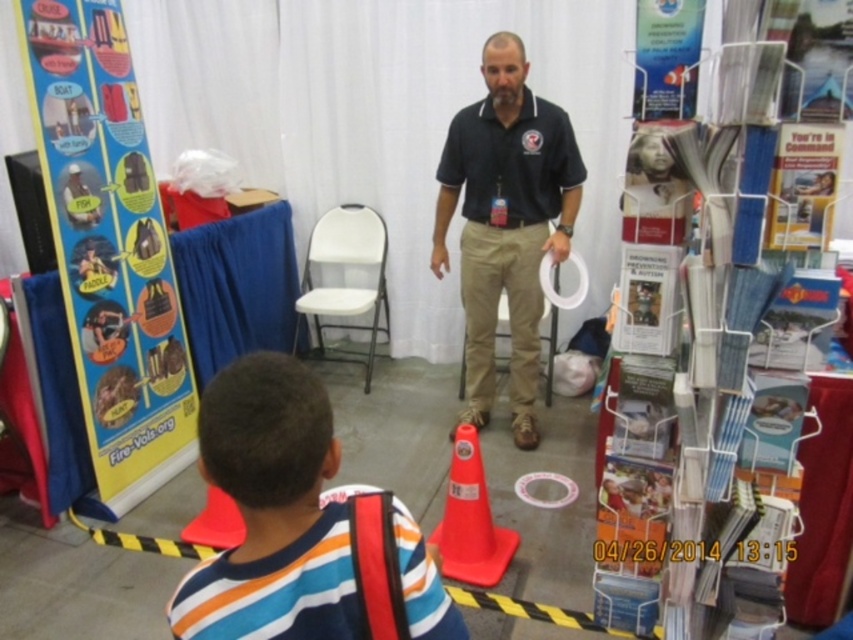
You are a photographer at the event and need to capture a photo that includes both the striped cotton shirt at lower left and the rubberized orange cone at center. Which object should you adjust your camera focus to first to ensure both are in frame?

The striped cotton shirt at lower left is smaller than the rubberized orange cone at center, so you should focus on the larger object first to ensure both fit in the frame.

You are a photographer at the event and want to take a photo of the black cotton shirt at center and the rubberized orange cone at center. Which object should you focus on first if you want to capture both in the frame without moving the camera?

The black cotton shirt at center is much taller than the rubberized orange cone at center, so you should focus on the black cotton shirt at center first to ensure it fits within the frame.